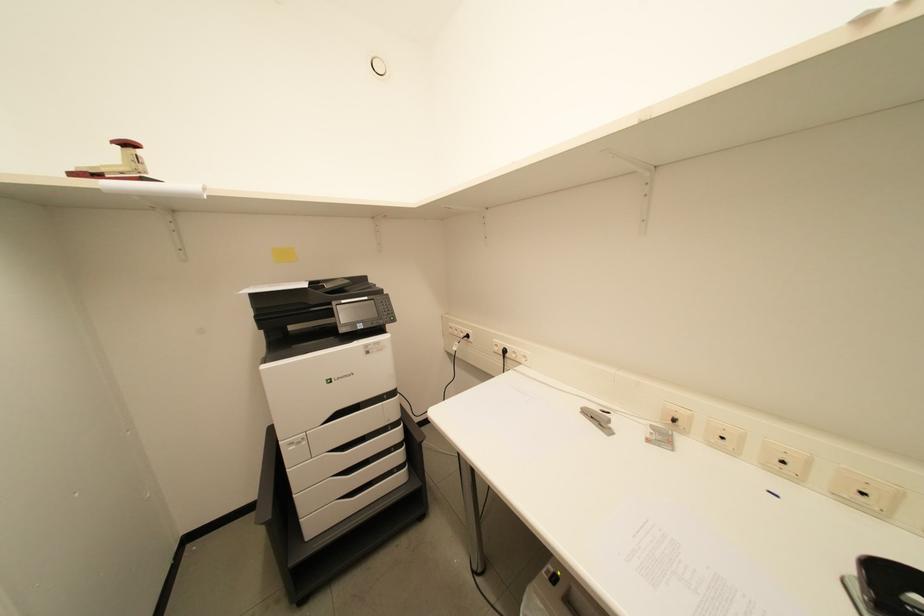
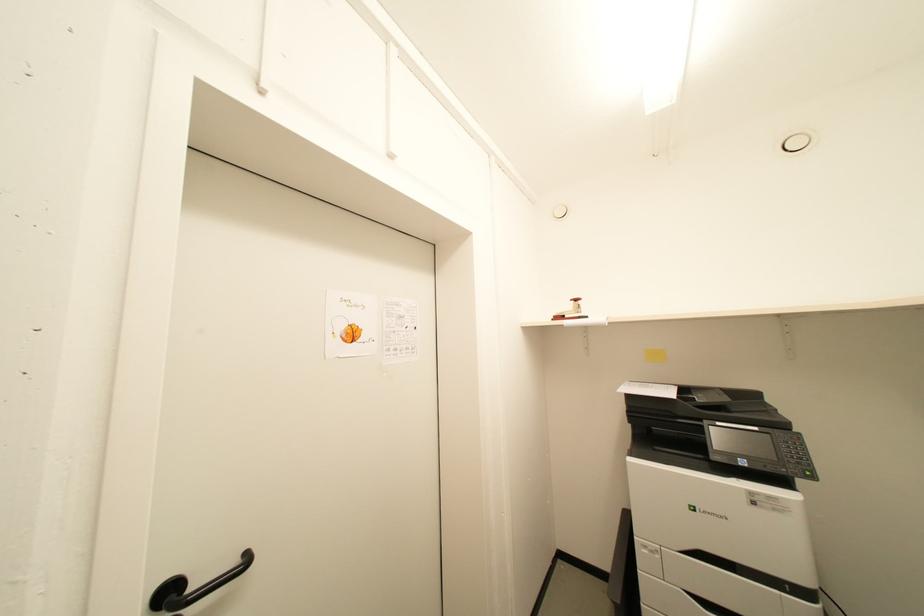
Question: Based on the continuous images, in which direction is the camera rotating? Reply with the corresponding letter.

Choices:
 (A) Left
 (B) Right
 (C) Up
 (D) Down

Answer: (A)